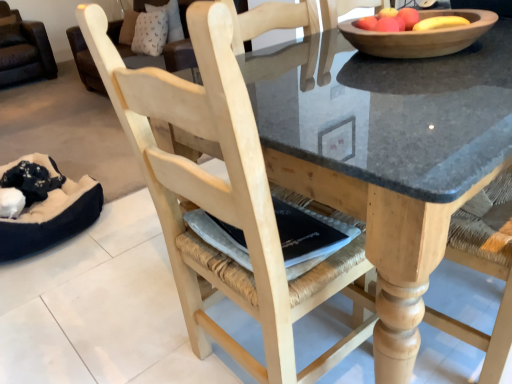
Find the location of a particular element. The width and height of the screenshot is (512, 384). vacant space in front of wooden bowl at upper center is located at coordinates coord(418,95).